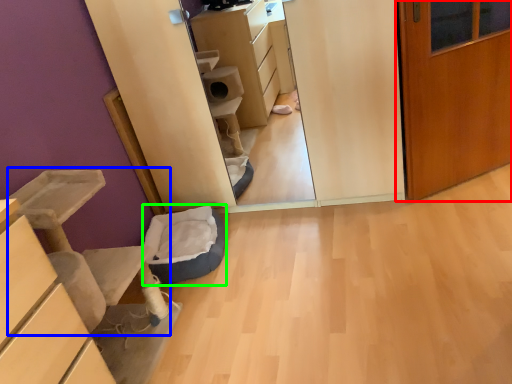
Question: Based on their relative distances, which object is farther from door (highlighted by a red box)? Choose from furniture (highlighted by a blue box) and cat bed (highlighted by a green box).

Choices:
 (A) furniture
 (B) cat bed

Answer: (A)